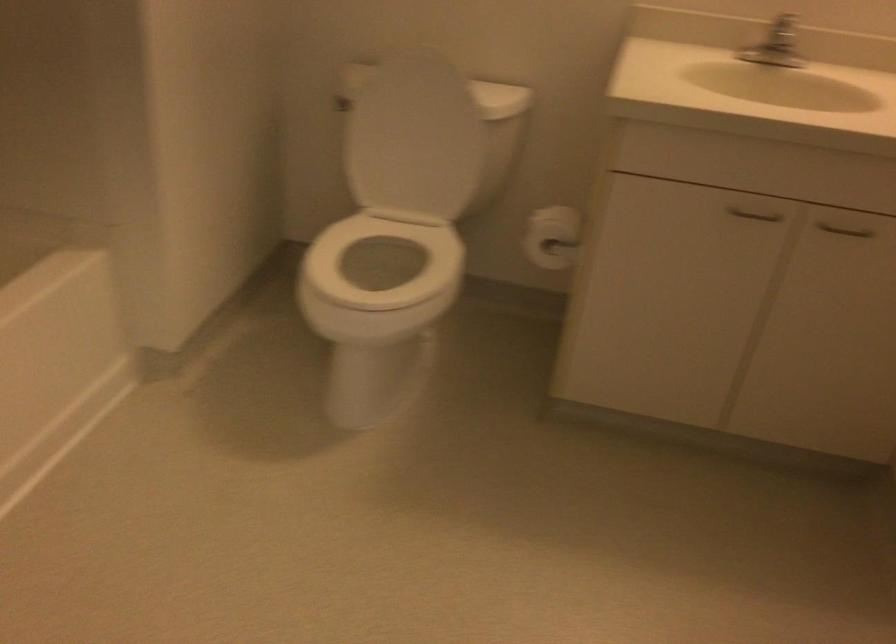
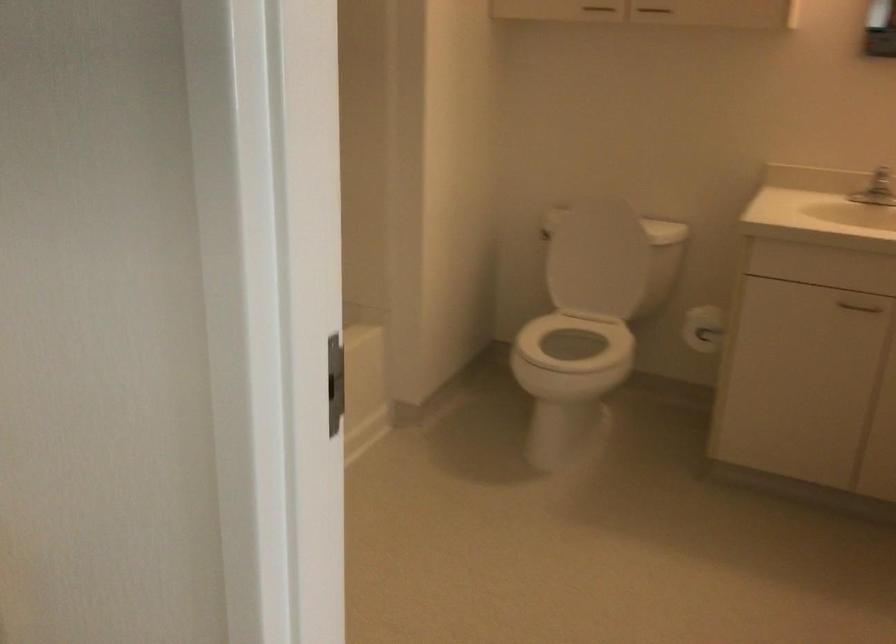
Find the pixel in the second image that matches point (561, 236) in the first image.

(702, 328)